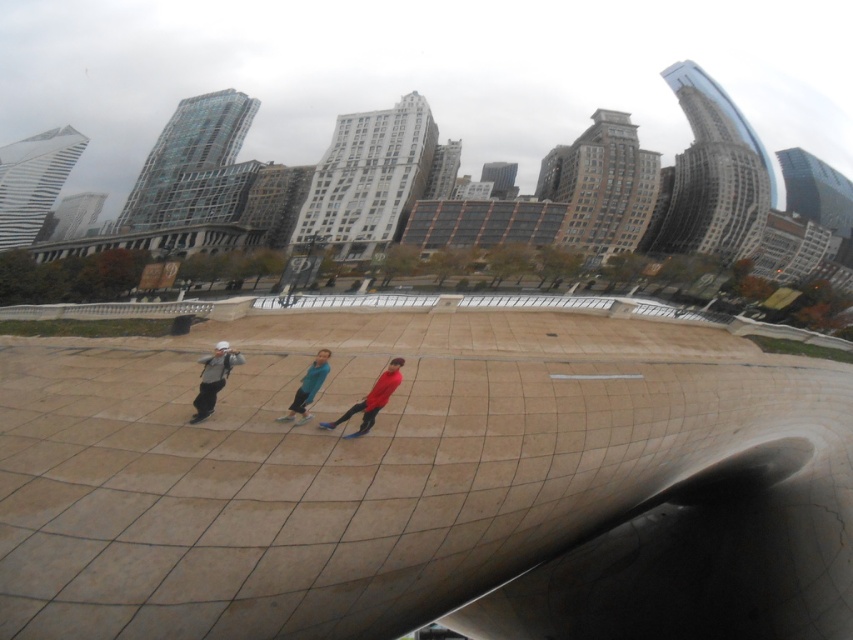
You are a photographer trying to capture a candid shot of the matte gray jacket at center and the blue fabric pants at center. Since you want to emphasize the size difference between them, which object should you focus on to highlight its larger size?

The matte gray jacket at center is larger than the blue fabric pants at center, so focusing on the matte gray jacket at center will emphasize its larger size.

You are a photographer trying to capture a shot of the two people in the center of the plaza. The matte red jacket at center and the blue fabric pants at center are both in your frame. If you want to ensure both subjects are fully visible without cropping, which subject should you focus on to account for their size difference?

The matte red jacket at center is wider than the blue fabric pants at center. To ensure both are fully visible, focus on the matte red jacket at center since it requires more space in the frame.

Based on the photo, you are a photographer trying to capture a photo of the matte gray jacket at center and the matte red jacket at center. Which jacket should you focus on if you want to highlight the one that is taller?

The matte gray jacket at center is much taller than the matte red jacket at center, so you should focus on the matte gray jacket at center to highlight its height.